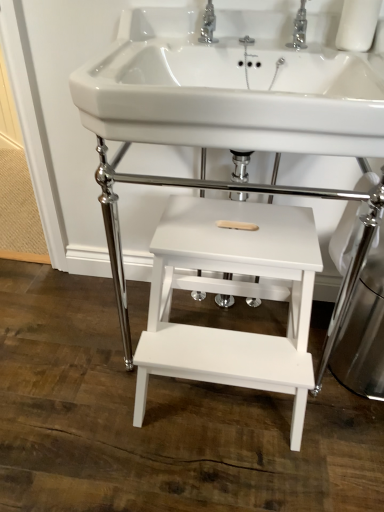
The image size is (384, 512). I want to click on white matte wood step stool at center, which is the second table in bottom-to-top order, so click(236, 191).

Identify the location of chrome metallic tap at upper center, positioned as the second tap in left-to-right order. The height and width of the screenshot is (512, 384). (299, 29).

Describe the element at coordinates (232, 294) in the screenshot. This screenshot has height=512, width=384. I see `white wood step stool at center, which appears as the first table when ordered from the bottom` at that location.

Locate an element on the screen. polished chrome tap at upper center, arranged as the 1th tap when viewed from the left is located at coordinates (208, 25).

From the image's perspective, between polished chrome tap at upper center, the 2th tap when ordered from right to left, and white matte wood step stool at center, which is the 1th table from top to bottom, who is located below?

white matte wood step stool at center, which is the 1th table from top to bottom, appears lower in the image.

Is polished chrome tap at upper center, the 2th tap when ordered from right to left, taller than white matte wood step stool at center, which is the second table in bottom-to-top order?

No, polished chrome tap at upper center, the 2th tap when ordered from right to left, is not taller than white matte wood step stool at center, which is the second table in bottom-to-top order.

Does polished chrome tap at upper center, arranged as the 1th tap when viewed from the left, have a smaller size compared to white matte wood step stool at center, which is the 1th table from top to bottom?

Yes.

Is the depth of white glossy sink at center greater than that of polished chrome tap at upper center, the 2th tap when ordered from right to left?

That is False.

Which object is positioned more to the right, white glossy sink at center or polished chrome tap at upper center, arranged as the 1th tap when viewed from the left?

From the viewer's perspective, white glossy sink at center appears more on the right side.

Are white glossy sink at center and polished chrome tap at upper center, the 2th tap when ordered from right to left, making contact?

They are not placed beside each other.

Can you confirm if white glossy sink at center is smaller than polished chrome tap at upper center, arranged as the 1th tap when viewed from the left?

Actually, white glossy sink at center might be larger than polished chrome tap at upper center, arranged as the 1th tap when viewed from the left.

Based on their sizes in the image, would you say white wood step stool at center, the second table when ordered from top to bottom, is bigger or smaller than polished chrome tap at upper center, arranged as the 1th tap when viewed from the left?

white wood step stool at center, the second table when ordered from top to bottom, is bigger than polished chrome tap at upper center, arranged as the 1th tap when viewed from the left.

Is white wood step stool at center, the second table when ordered from top to bottom, in contact with polished chrome tap at upper center, arranged as the 1th tap when viewed from the left?

No, white wood step stool at center, the second table when ordered from top to bottom, is not in contact with polished chrome tap at upper center, arranged as the 1th tap when viewed from the left.

Between white wood step stool at center, which appears as the first table when ordered from the bottom, and polished chrome tap at upper center, the 2th tap when ordered from right to left, which one has more height?

white wood step stool at center, which appears as the first table when ordered from the bottom, is taller.

Is white glossy sink at center surrounding chrome metallic tap at upper center, positioned as the second tap in left-to-right order?

Yes, chrome metallic tap at upper center, positioned as the second tap in left-to-right order, is a part of white glossy sink at center.

Is white glossy sink at center positioned behind chrome metallic tap at upper center, which is the 1th tap in right-to-left order?

No, white glossy sink at center is in front of chrome metallic tap at upper center, which is the 1th tap in right-to-left order.

Which point is more distant from viewer, [318,51] or [302,1]?

Positioned behind is point [302,1].

Is white glossy sink at center taller or shorter than chrome metallic tap at upper center, positioned as the second tap in left-to-right order?

Clearly, white glossy sink at center is taller compared to chrome metallic tap at upper center, positioned as the second tap in left-to-right order.

Considering the relative positions of white matte wood step stool at center, which is the 1th table from top to bottom, and chrome metallic tap at upper center, positioned as the second tap in left-to-right order, in the image provided, is white matte wood step stool at center, which is the 1th table from top to bottom, to the left of chrome metallic tap at upper center, positioned as the second tap in left-to-right order, from the viewer's perspective?

Yes.

Is white matte wood step stool at center, which is the second table in bottom-to-top order, positioned beyond the bounds of chrome metallic tap at upper center, which is the 1th tap in right-to-left order?

Indeed, white matte wood step stool at center, which is the second table in bottom-to-top order, is completely outside chrome metallic tap at upper center, which is the 1th tap in right-to-left order.

Considering the sizes of objects white matte wood step stool at center, which is the 1th table from top to bottom, and chrome metallic tap at upper center, which is the 1th tap in right-to-left order, in the image provided, who is taller, white matte wood step stool at center, which is the 1th table from top to bottom, or chrome metallic tap at upper center, which is the 1th tap in right-to-left order,?

With more height is white matte wood step stool at center, which is the 1th table from top to bottom.

In terms of width, does white matte wood step stool at center, which is the 1th table from top to bottom, look wider or thinner when compared to chrome metallic tap at upper center, which is the 1th tap in right-to-left order?

white matte wood step stool at center, which is the 1th table from top to bottom, is wider than chrome metallic tap at upper center, which is the 1th tap in right-to-left order.

Who is smaller, polished chrome tap at upper center, the 2th tap when ordered from right to left, or chrome metallic tap at upper center, positioned as the second tap in left-to-right order?

chrome metallic tap at upper center, positioned as the second tap in left-to-right order, is smaller.

Can you tell me how much polished chrome tap at upper center, arranged as the 1th tap when viewed from the left, and chrome metallic tap at upper center, positioned as the second tap in left-to-right order, differ in facing direction?

The angular difference between polished chrome tap at upper center, arranged as the 1th tap when viewed from the left, and chrome metallic tap at upper center, positioned as the second tap in left-to-right order, is 0.00214 degrees.

Is polished chrome tap at upper center, the 2th tap when ordered from right to left, turned away from chrome metallic tap at upper center, which is the 1th tap in right-to-left order?

polished chrome tap at upper center, the 2th tap when ordered from right to left, is not turned away from chrome metallic tap at upper center, which is the 1th tap in right-to-left order.

Is polished chrome tap at upper center, the 2th tap when ordered from right to left, inside the boundaries of chrome metallic tap at upper center, positioned as the second tap in left-to-right order, or outside?

polished chrome tap at upper center, the 2th tap when ordered from right to left, is spatially situated outside chrome metallic tap at upper center, positioned as the second tap in left-to-right order.

Is white matte wood step stool at center, which is the second table in bottom-to-top order, oriented towards white wood step stool at center, the second table when ordered from top to bottom?

Yes, white matte wood step stool at center, which is the second table in bottom-to-top order, is facing white wood step stool at center, the second table when ordered from top to bottom.

Is white matte wood step stool at center, which is the second table in bottom-to-top order, taller than white wood step stool at center, the second table when ordered from top to bottom?

Yes, white matte wood step stool at center, which is the second table in bottom-to-top order, is taller than white wood step stool at center, the second table when ordered from top to bottom.

How many degrees apart are the facing directions of white matte wood step stool at center, which is the second table in bottom-to-top order, and white wood step stool at center, the second table when ordered from top to bottom?

The angular difference between white matte wood step stool at center, which is the second table in bottom-to-top order, and white wood step stool at center, the second table when ordered from top to bottom, is 0.000523 degrees.

Is the depth of white matte wood step stool at center, which is the second table in bottom-to-top order, less than that of white wood step stool at center, which appears as the first table when ordered from the bottom?

Yes, the depth of white matte wood step stool at center, which is the second table in bottom-to-top order, is less than that of white wood step stool at center, which appears as the first table when ordered from the bottom.

In order to click on the 1st table positioned below the polished chrome tap at upper center, arranged as the 1th tap when viewed from the left (from a real-world perspective) in this screenshot , I will do `click(236, 191)`.

Locate an element on the screen. The width and height of the screenshot is (384, 512). sink that appears on the right of polished chrome tap at upper center, the 2th tap when ordered from right to left is located at coordinates (228, 92).

Which object lies further to the anchor point chrome metallic tap at upper center, which is the 1th tap in right-to-left order, white matte wood step stool at center, which is the 1th table from top to bottom, or white wood step stool at center, which appears as the first table when ordered from the bottom?

white wood step stool at center, which appears as the first table when ordered from the bottom, lies further to chrome metallic tap at upper center, which is the 1th tap in right-to-left order, than the other object.

When comparing their distances from white matte wood step stool at center, which is the 1th table from top to bottom, does white glossy sink at center or polished chrome tap at upper center, arranged as the 1th tap when viewed from the left, seem closer?

white glossy sink at center is closer to white matte wood step stool at center, which is the 1th table from top to bottom.

From the image, which object appears to be farther from white matte wood step stool at center, which is the second table in bottom-to-top order, chrome metallic tap at upper center, which is the 1th tap in right-to-left order, or white wood step stool at center, the second table when ordered from top to bottom?

chrome metallic tap at upper center, which is the 1th tap in right-to-left order, lies further to white matte wood step stool at center, which is the second table in bottom-to-top order, than the other object.

Estimate the real-world distances between objects in this image. Which object is further from white glossy sink at center, polished chrome tap at upper center, arranged as the 1th tap when viewed from the left, or white matte wood step stool at center, which is the 1th table from top to bottom?

white matte wood step stool at center, which is the 1th table from top to bottom, is positioned further to the anchor white glossy sink at center.

Estimate the real-world distances between objects in this image. Which object is further from white glossy sink at center, white matte wood step stool at center, which is the 1th table from top to bottom, or polished chrome tap at upper center, the 2th tap when ordered from right to left?

The object further to white glossy sink at center is white matte wood step stool at center, which is the 1th table from top to bottom.

Considering their positions, is white glossy sink at center positioned further to chrome metallic tap at upper center, which is the 1th tap in right-to-left order, than polished chrome tap at upper center, the 2th tap when ordered from right to left?

white glossy sink at center is further to chrome metallic tap at upper center, which is the 1th tap in right-to-left order.

Estimate the real-world distances between objects in this image. Which object is closer to white wood step stool at center, the second table when ordered from top to bottom, chrome metallic tap at upper center, which is the 1th tap in right-to-left order, or white glossy sink at center?

white glossy sink at center is positioned closer to the anchor white wood step stool at center, the second table when ordered from top to bottom.

When comparing their distances from white matte wood step stool at center, which is the second table in bottom-to-top order, does white wood step stool at center, which appears as the first table when ordered from the bottom, or chrome metallic tap at upper center, positioned as the second tap in left-to-right order, seem further?

chrome metallic tap at upper center, positioned as the second tap in left-to-right order, is positioned further to the anchor white matte wood step stool at center, which is the second table in bottom-to-top order.

You are a GUI agent. You are given a task and a screenshot of the screen. Output one action in this format:
    pyautogui.click(x=<x>, y=<y>)
    Task: Click on the sink between chrome metallic tap at upper center, which is the 1th tap in right-to-left order, and white wood step stool at center, the second table when ordered from top to bottom, from top to bottom
    This screenshot has width=384, height=512.
    Given the screenshot: What is the action you would take?
    pyautogui.click(x=228, y=92)

Where is `sink between polished chrome tap at upper center, arranged as the 1th tap when viewed from the left, and white wood step stool at center, which appears as the first table when ordered from the bottom, vertically`? Image resolution: width=384 pixels, height=512 pixels. sink between polished chrome tap at upper center, arranged as the 1th tap when viewed from the left, and white wood step stool at center, which appears as the first table when ordered from the bottom, vertically is located at coordinates (228, 92).

At what (x,y) coordinates should I click in order to perform the action: click on tap that lies between polished chrome tap at upper center, the 2th tap when ordered from right to left, and white matte wood step stool at center, which is the second table in bottom-to-top order, from top to bottom. Please return your answer as a coordinate pair (x, y). Image resolution: width=384 pixels, height=512 pixels. Looking at the image, I should click on (299, 29).

The image size is (384, 512). Identify the location of tap located between white glossy sink at center and polished chrome tap at upper center, the 2th tap when ordered from right to left, in the depth direction. click(x=299, y=29).